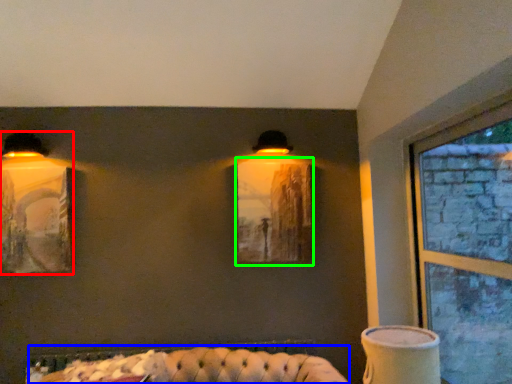
Question: Based on their relative distances, which object is farther from lamp (highlighted by a red box)? Choose from couch (highlighted by a blue box) and picture frame (highlighted by a green box).

Choices:
 (A) couch
 (B) picture frame

Answer: (B)